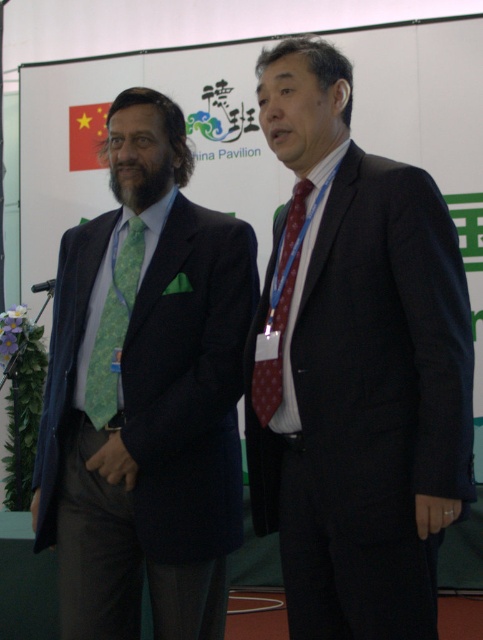
You are organizing a photo shoot and need to ensure that all attire items are appropriately sized. Given the scene described, can the green patterned tie at left be worn by the person wearing the dark blue suit at center?

The dark blue suit at center has a larger size compared to the green patterned tie at left. Since the tie is smaller than the suit, it may not proportionally match the size of the dark blue suit at center. It is advisable to check for a larger tie that better complements the suit size.

You are organizing a formal event and need to ensure that all participants follow the dress code, which requires ties to be no wider than 3 inches. You notice two men in the scene wearing green ties labeled as green textured tie at left and green patterned tie at left. Based on the provided information, can you determine if either of these ties violates the dress code?

The green textured tie at left might be wider than the green patterned tie at left, but without specific measurements, it is impossible to confirm if either violates the 3 inch width requirement. Further measurement is needed.

You are a photographer setting up for a group photo and need to ensure that both the dark blue suit at center and the green patterned tie at left are clearly visible in the frame. Given that your camera has a depth of field that can sharply focus on objects within a 60 cm range, will both items remain in focus?

The dark blue suit at center is 61.52 centimeters away from the green patterned tie at left. Since the distance between them exceeds the camera sensor depth of field range of 60 cm, the two items cannot be both in focus at the same time.